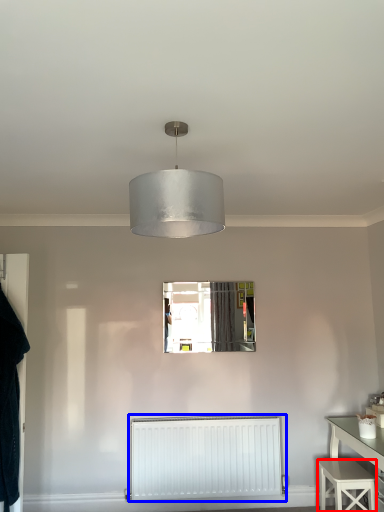
Question: Which of the following is the farthest to the observer, stool (highlighted by a red box) or radiator (highlighted by a blue box)?

Choices:
 (A) stool
 (B) radiator

Answer: (B)